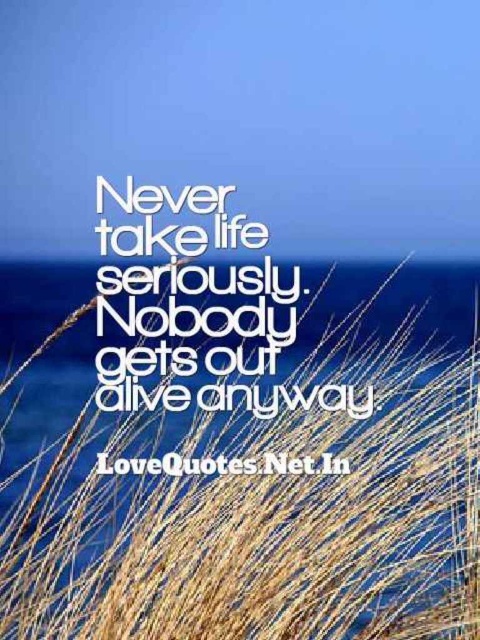
You are a photographer trying to capture the brown dry grass at center in your shot. The grass is located at coordinates point 0.717, 0.502. If your camera has a focus point at 0.7, 0.5, will you be able to focus on the grass?

The brown dry grass at center is located at point (240, 458). Since the camera focus point is at (240, 448), the grass is slightly to the right and above the focus point. Therefore, you might need to adjust the focus point to align with the grass at (240, 458) for optimal clarity.

You are an artist trying to paint this coastal scene. You want to ensure the brown dry grass at center and the white text at center are proportionate. Which object should you paint first if you want to place the taller one higher on the canvas?

The brown dry grass at center is taller than the white text at center, so you should paint the brown dry grass at center first to place it higher on the canvas.